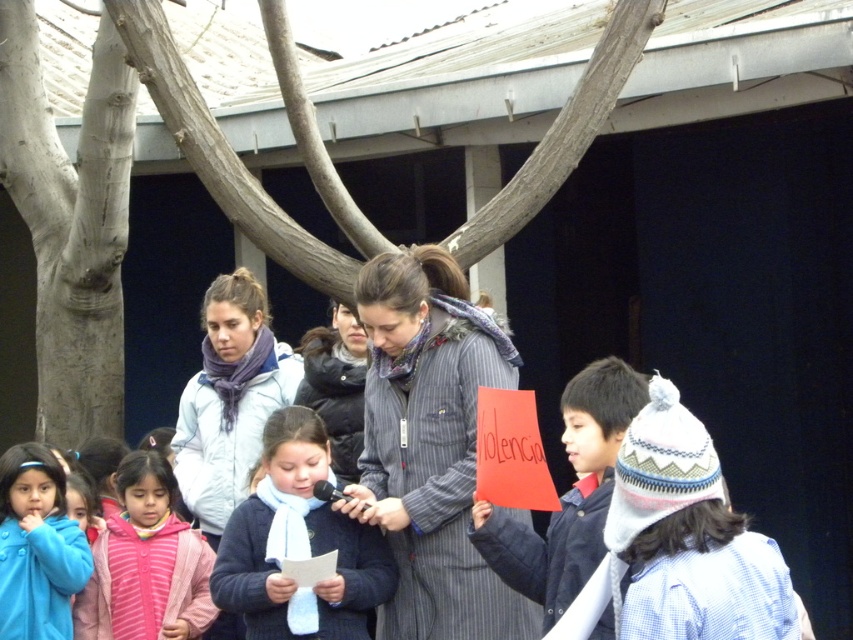
Question: Based on their relative distances, which object is nearer to the dark blue sweater at center?

Choices:
 (A) light blue jacket at center
 (B) pink fleece jacket at lower left
 (C) smooth white bark at center

Answer: (B)

Question: Is dark blue sweater at center to the right of light blue jacket at center from the viewer's perspective?

Choices:
 (A) yes
 (B) no

Answer: (A)

Question: Estimate the real-world distances between objects in this image. Which object is closer to the dark blue sweater at center?

Choices:
 (A) blue fleece jacket at lower left
 (B) white knitted hat at lower right
 (C) light blue jacket at center
 (D) pink fleece jacket at lower left

Answer: (D)

Question: Is dark blue sweater at center above matte red paper at center?

Choices:
 (A) yes
 (B) no

Answer: (B)

Question: Which object is the closest to the smooth white bark at center?

Choices:
 (A) striped wool coat at center
 (B) matte red paper at center
 (C) light blue jacket at center

Answer: (C)

Question: Does striped wool coat at center appear on the right side of smooth white bark at center?

Choices:
 (A) no
 (B) yes

Answer: (B)